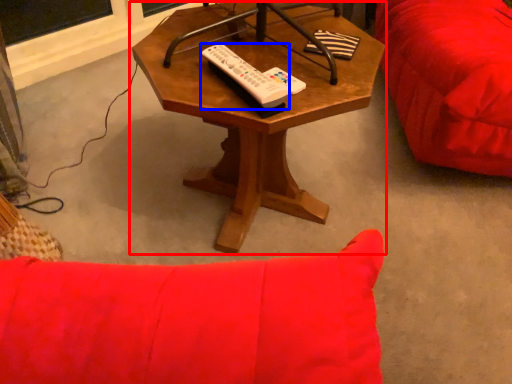
Question: Among these objects, which one is nearest to the camera, coffee table (highlighted by a red box) or remote (highlighted by a blue box)?

Choices:
 (A) coffee table
 (B) remote

Answer: (A)